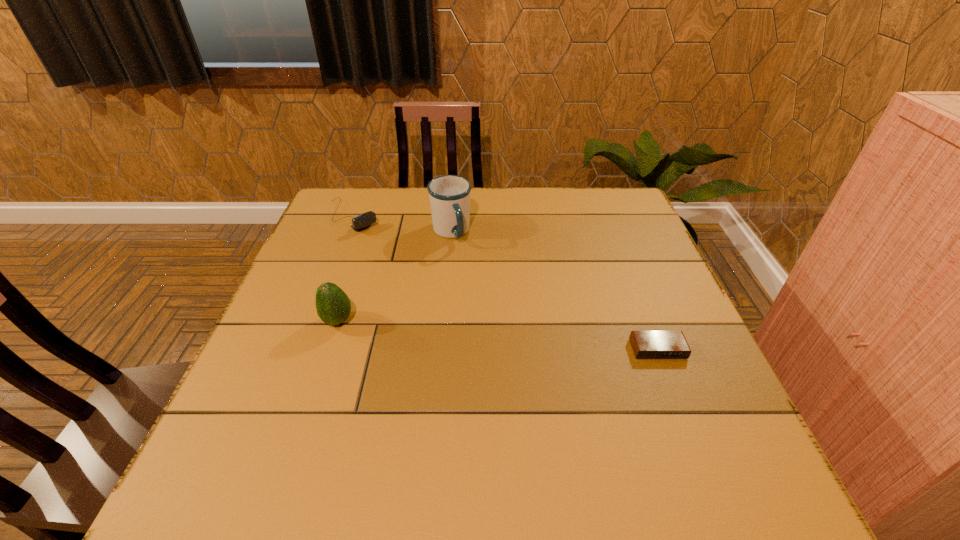
Identify the location of free region located 0.200m on the handle side of the third object from left to right. (487, 294).

Find the location of a particular element. free space located 0.070m on the handle side of the third object from left to right is located at coordinates (468, 263).

At what (x,y) coordinates should I click in order to perform the action: click on vacant point located on the front-facing side of the third tallest object. Please return your answer as a coordinate pair (x, y). The width and height of the screenshot is (960, 540). Looking at the image, I should click on (418, 275).

Locate an element on the screen. free location located on the front-facing side of the third tallest object is located at coordinates (429, 285).

Where is `vacant region located on the front-facing side of the third tallest object`? vacant region located on the front-facing side of the third tallest object is located at coordinates (380, 244).

This screenshot has width=960, height=540. What are the coordinates of `mug situated at the far edge` in the screenshot? It's located at (449, 195).

Where is `webcam present at the far edge`? The image size is (960, 540). webcam present at the far edge is located at coordinates (362, 221).

At what (x,y) coordinates should I click in order to perform the action: click on avocado located in the left edge section of the desktop. Please return your answer as a coordinate pair (x, y). Image resolution: width=960 pixels, height=540 pixels. Looking at the image, I should click on (333, 306).

What are the coordinates of `webcam that is at the left edge` in the screenshot? It's located at (362, 221).

Find the location of a particular element. The height and width of the screenshot is (540, 960). object that is at the right edge is located at coordinates (646, 344).